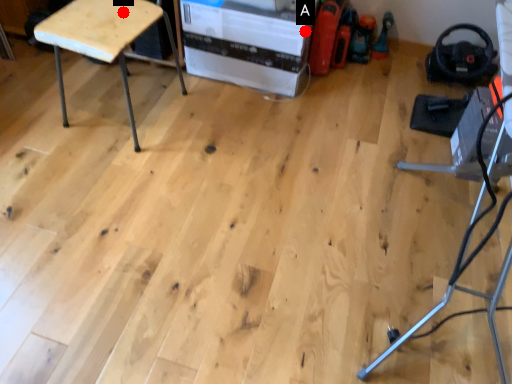
Question: Two points are circled on the image, labeled by A and B beside each circle. Among these points, which one is nearest to the camera?

Choices:
 (A) A is closer
 (B) B is closer

Answer: (B)